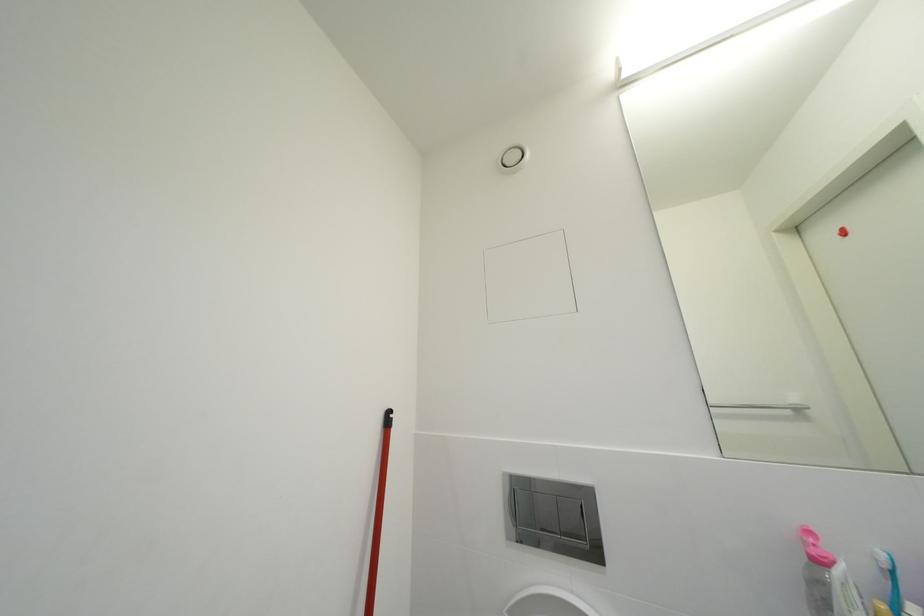
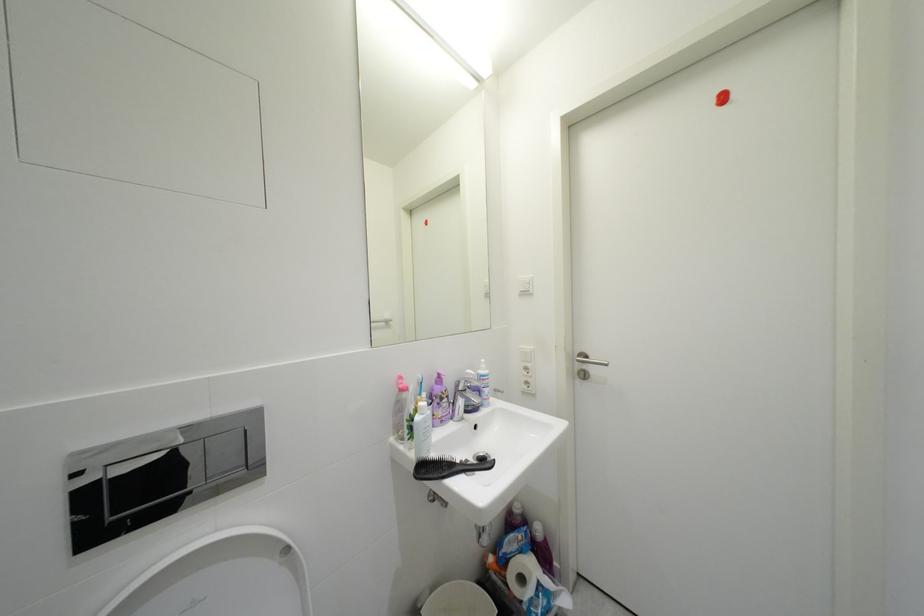
Question: The camera is either moving clockwise (left) or counter-clockwise (right) around the object. The first image is from the beginning of the video and the second image is from the end. Is the camera moving left or right when shooting the video?

Choices:
 (A) Left
 (B) Right

Answer: (A)